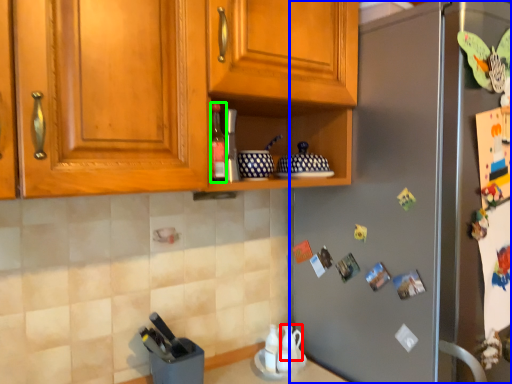
Question: Which object is the closest to the tea pot (highlighted by a red box)? Choose among these: refrigerator (highlighted by a blue box) or bottle (highlighted by a green box).

Choices:
 (A) refrigerator
 (B) bottle

Answer: (A)